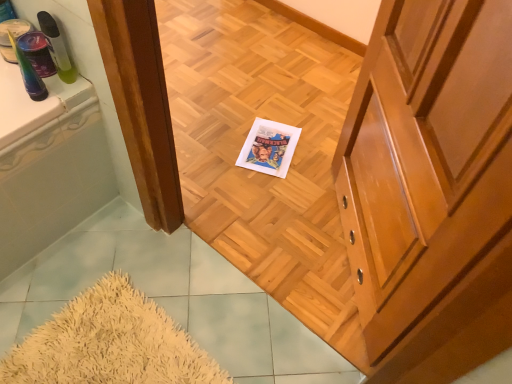
Describe the element at coordinates (29, 73) in the screenshot. This screenshot has height=384, width=512. I see `translucent plastic cup at upper left, the first toiletry viewed from the left` at that location.

Identify the location of translucent plastic cup at upper left, the first toiletry viewed from the left. The height and width of the screenshot is (384, 512). (29, 73).

Between point (35, 93) and point (426, 137), which one is positioned in front?

Point (426, 137)

Based on their positions, is translucent plastic cup at upper left, which ranks as the 2th toiletry in right-to-left order, located to the left or right of shiny wood cabinet at right?

From the image, it's evident that translucent plastic cup at upper left, which ranks as the 2th toiletry in right-to-left order, is to the left of shiny wood cabinet at right.

Considering the relative positions of translucent plastic cup at upper left, the first toiletry viewed from the left, and shiny wood cabinet at right in the image provided, is translucent plastic cup at upper left, the first toiletry viewed from the left, behind shiny wood cabinet at right?

Yes, translucent plastic cup at upper left, the first toiletry viewed from the left, is behind shiny wood cabinet at right.

Is translucent plastic cup at upper left, the first toiletry viewed from the left, situated inside shiny wood cabinet at right or outside?

translucent plastic cup at upper left, the first toiletry viewed from the left, is outside shiny wood cabinet at right.

Does translucent plastic spray bottle at upper left, which ranks as the second toiletry in left-to-right order, have a smaller size compared to translucent plastic cup at upper left, which ranks as the 2th toiletry in right-to-left order?

Indeed, translucent plastic spray bottle at upper left, which ranks as the second toiletry in left-to-right order, has a smaller size compared to translucent plastic cup at upper left, which ranks as the 2th toiletry in right-to-left order.

Is translucent plastic spray bottle at upper left, which ranks as the second toiletry in left-to-right order, touching translucent plastic cup at upper left, which ranks as the 2th toiletry in right-to-left order?

Yes, translucent plastic spray bottle at upper left, which ranks as the second toiletry in left-to-right order, is with translucent plastic cup at upper left, which ranks as the 2th toiletry in right-to-left order.

In the image, there is a translucent plastic spray bottle at upper left, marked as the 1th toiletry in a right-to-left arrangement. At what (x,y) coordinates should I click in order to perform the action: click on toiletry below it (from the image's perspective). Please return your answer as a coordinate pair (x, y). Looking at the image, I should click on (29, 73).

In the image, is translucent plastic spray bottle at upper left, which ranks as the second toiletry in left-to-right order, positioned in front of or behind translucent plastic cup at upper left, which ranks as the 2th toiletry in right-to-left order?

Clearly, translucent plastic spray bottle at upper left, which ranks as the second toiletry in left-to-right order, is behind translucent plastic cup at upper left, which ranks as the 2th toiletry in right-to-left order.

From a real-world perspective, count 2nd toiletrys upward from the shiny wood cabinet at right and point to it. Please provide its 2D coordinates.

[(57, 48)]

Considering the sizes of objects translucent plastic spray bottle at upper left, marked as the 1th toiletry in a right-to-left arrangement, and shiny wood cabinet at right in the image provided, who is thinner, translucent plastic spray bottle at upper left, marked as the 1th toiletry in a right-to-left arrangement, or shiny wood cabinet at right?

translucent plastic spray bottle at upper left, marked as the 1th toiletry in a right-to-left arrangement.

Can you confirm if translucent plastic spray bottle at upper left, marked as the 1th toiletry in a right-to-left arrangement, is bigger than shiny wood cabinet at right?

No.

From the image's perspective, would you say shiny wood cabinet at right is positioned over translucent plastic spray bottle at upper left, which ranks as the second toiletry in left-to-right order?

Actually, shiny wood cabinet at right appears below translucent plastic spray bottle at upper left, which ranks as the second toiletry in left-to-right order, in the image.

The width and height of the screenshot is (512, 384). Identify the location of the 2nd toiletry behind the shiny wood cabinet at right. (57, 48).

Does shiny wood cabinet at right contain translucent plastic spray bottle at upper left, which ranks as the second toiletry in left-to-right order?

No, translucent plastic spray bottle at upper left, which ranks as the second toiletry in left-to-right order, is not a part of shiny wood cabinet at right.

From a real-world perspective, is shiny wood cabinet at right positioned over translucent plastic spray bottle at upper left, marked as the 1th toiletry in a right-to-left arrangement, based on gravity?

Incorrect, from a real-world perspective, shiny wood cabinet at right is lower than translucent plastic spray bottle at upper left, marked as the 1th toiletry in a right-to-left arrangement.

Is translucent plastic cup at upper left, the first toiletry viewed from the left, completely or partially inside shiny wood cabinet at right?

No, translucent plastic cup at upper left, the first toiletry viewed from the left, is not inside shiny wood cabinet at right.

Between shiny wood cabinet at right and translucent plastic cup at upper left, which ranks as the 2th toiletry in right-to-left order, which one is positioned in front?

shiny wood cabinet at right is in front.

Is shiny wood cabinet at right positioned far away from translucent plastic cup at upper left, which ranks as the 2th toiletry in right-to-left order?

No, there isn't a large distance between shiny wood cabinet at right and translucent plastic cup at upper left, which ranks as the 2th toiletry in right-to-left order.

From the image's perspective, does shiny wood cabinet at right appear higher than translucent plastic cup at upper left, the first toiletry viewed from the left?

Incorrect, from the image's perspective, shiny wood cabinet at right is lower than translucent plastic cup at upper left, the first toiletry viewed from the left.

Is point (37, 80) closer or farther from the camera than point (44, 33)?

Clearly, point (37, 80) is closer to the camera than point (44, 33).

Can you tell me how much translucent plastic cup at upper left, the first toiletry viewed from the left, and translucent plastic spray bottle at upper left, marked as the 1th toiletry in a right-to-left arrangement, differ in facing direction?

There is a 1.7e-05-degree angle between the facing directions of translucent plastic cup at upper left, the first toiletry viewed from the left, and translucent plastic spray bottle at upper left, marked as the 1th toiletry in a right-to-left arrangement.

Is translucent plastic cup at upper left, the first toiletry viewed from the left, shorter than translucent plastic spray bottle at upper left, marked as the 1th toiletry in a right-to-left arrangement?

No.

Which toiletry is the 2nd one when counting from the left side of the shiny wood cabinet at right? Please provide its 2D coordinates.

[(29, 73)]

Where is `toiletry that is in front of the translucent plastic spray bottle at upper left, which ranks as the second toiletry in left-to-right order`? toiletry that is in front of the translucent plastic spray bottle at upper left, which ranks as the second toiletry in left-to-right order is located at coordinates (29, 73).

Based on their spatial positions, is translucent plastic cup at upper left, which ranks as the 2th toiletry in right-to-left order, or translucent plastic spray bottle at upper left, marked as the 1th toiletry in a right-to-left arrangement, further from shiny wood cabinet at right?

translucent plastic cup at upper left, which ranks as the 2th toiletry in right-to-left order.

Estimate the real-world distances between objects in this image. Which object is closer to translucent plastic cup at upper left, which ranks as the 2th toiletry in right-to-left order, shiny wood cabinet at right or translucent plastic spray bottle at upper left, marked as the 1th toiletry in a right-to-left arrangement?

Among the two, translucent plastic spray bottle at upper left, marked as the 1th toiletry in a right-to-left arrangement, is located nearer to translucent plastic cup at upper left, which ranks as the 2th toiletry in right-to-left order.

Based on their spatial positions, is translucent plastic cup at upper left, which ranks as the 2th toiletry in right-to-left order, or shiny wood cabinet at right closer to translucent plastic spray bottle at upper left, marked as the 1th toiletry in a right-to-left arrangement?

translucent plastic cup at upper left, which ranks as the 2th toiletry in right-to-left order, is positioned closer to the anchor translucent plastic spray bottle at upper left, marked as the 1th toiletry in a right-to-left arrangement.

Considering their positions, is translucent plastic spray bottle at upper left, marked as the 1th toiletry in a right-to-left arrangement, positioned closer to translucent plastic cup at upper left, which ranks as the 2th toiletry in right-to-left order, than shiny wood cabinet at right?

translucent plastic spray bottle at upper left, marked as the 1th toiletry in a right-to-left arrangement.

Looking at the image, which one is located further to shiny wood cabinet at right, translucent plastic spray bottle at upper left, which ranks as the second toiletry in left-to-right order, or translucent plastic cup at upper left, which ranks as the 2th toiletry in right-to-left order?

Among the two, translucent plastic cup at upper left, which ranks as the 2th toiletry in right-to-left order, is located further to shiny wood cabinet at right.

Which object lies further to the anchor point translucent plastic spray bottle at upper left, marked as the 1th toiletry in a right-to-left arrangement, shiny wood cabinet at right or translucent plastic cup at upper left, which ranks as the 2th toiletry in right-to-left order?

shiny wood cabinet at right is further to translucent plastic spray bottle at upper left, marked as the 1th toiletry in a right-to-left arrangement.

Find the location of a particular element. Image resolution: width=512 pixels, height=384 pixels. toiletry situated between translucent plastic cup at upper left, the first toiletry viewed from the left, and shiny wood cabinet at right from left to right is located at coordinates (57, 48).